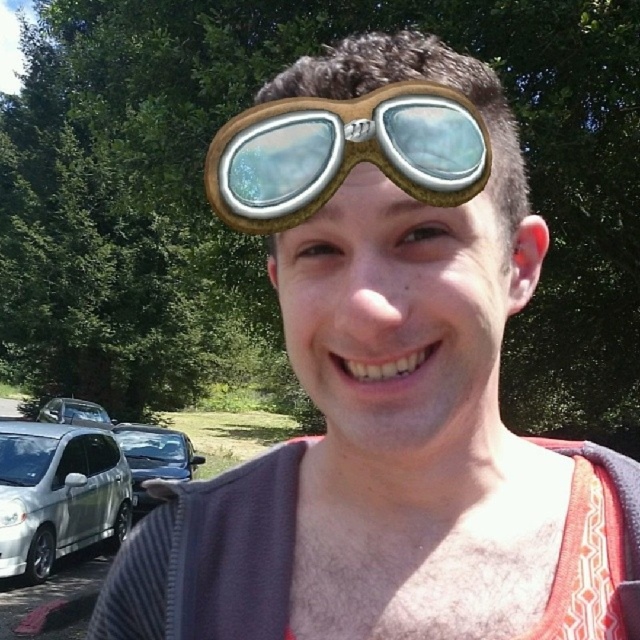
Which is in front, point (355, 115) or point (138, 449)?

Point (355, 115)

Describe the element at coordinates (344, 152) in the screenshot. I see `brown leather goggles at center` at that location.

Locate an element on the screen. Image resolution: width=640 pixels, height=640 pixels. brown leather goggles at center is located at coordinates (344, 152).

Does white matte car at lower left have a lesser width compared to white glossy car at lower left?

Yes, white matte car at lower left is thinner than white glossy car at lower left.

Does white matte car at lower left appear over white glossy car at lower left?

Yes.

Between point (1, 532) and point (49, 417), which one is positioned in front?

Point (1, 532) is more forward.

The width and height of the screenshot is (640, 640). Identify the location of white matte car at lower left. (58, 493).

Who is shorter, shiny black car at lower left or white glossy car at lower left?

With less height is white glossy car at lower left.

Looking at this image, who is more forward, (189, 467) or (61, 401)?

Point (189, 467) is more forward.

This screenshot has width=640, height=640. I want to click on shiny black car at lower left, so click(x=154, y=458).